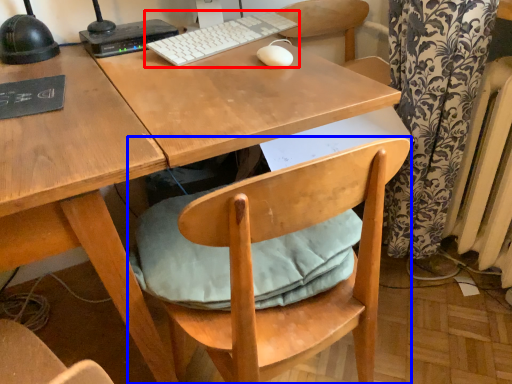
Question: Which of the following is the closest to the observer, computer keyboard (highlighted by a red box) or chair (highlighted by a blue box)?

Choices:
 (A) computer keyboard
 (B) chair

Answer: (B)